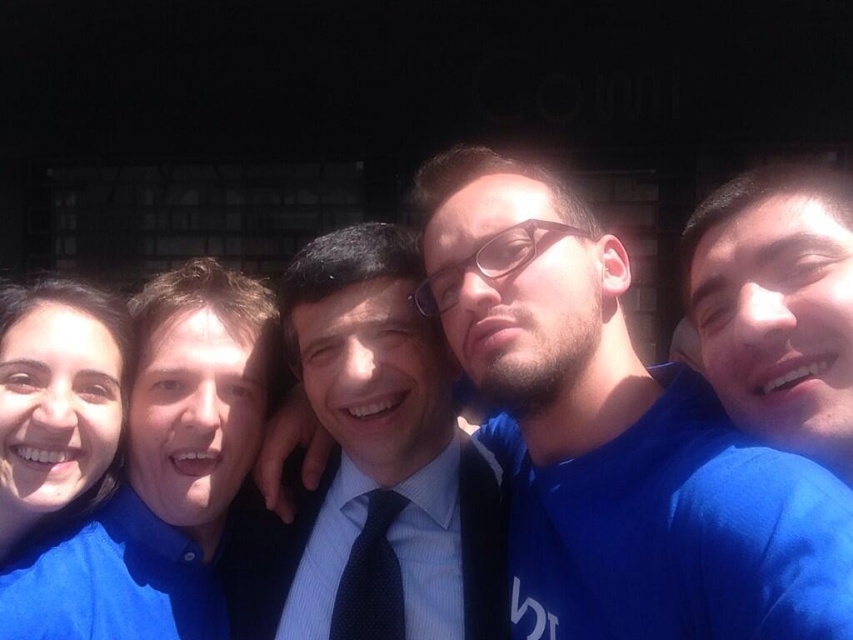
Question: Is blue silk tie at center thinner than matte blue shirt at left?

Choices:
 (A) no
 (B) yes

Answer: (A)

Question: Observing the image, what is the correct spatial positioning of blue fabric shirt at left in reference to matte blue shirt at left?

Choices:
 (A) below
 (B) above

Answer: (A)

Question: Estimate the real-world distances between objects in this image. Which object is farther from the matte blue shirt at left?

Choices:
 (A) blue silk tie at center
 (B) dark blue dotted tie at center

Answer: (B)

Question: Among these points, which one is nearest to the camera?

Choices:
 (A) (323, 314)
 (B) (350, 595)
 (C) (779, 506)

Answer: (C)

Question: Is the position of blue fabric shirt at center less distant than that of matte blue shirt at left?

Choices:
 (A) no
 (B) yes

Answer: (B)

Question: Which object is closer to the camera taking this photo?

Choices:
 (A) dark blue dotted tie at center
 (B) blue fabric shirt at left
 (C) blue fabric shirt at center
 (D) matte blue shirt at left

Answer: (C)